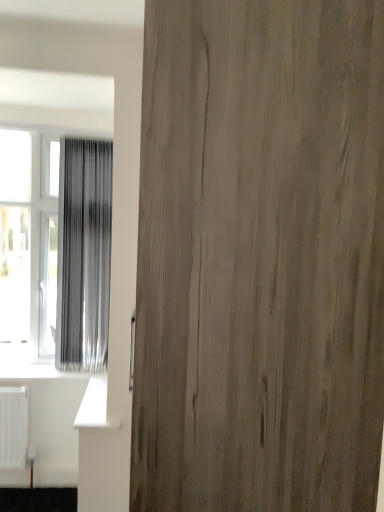
Question: From the image's perspective, would you say silvery metallic curtain at left is shown under wooden door at center?

Choices:
 (A) yes
 (B) no

Answer: (B)

Question: Does silvery metallic curtain at left have a larger size compared to wooden door at center?

Choices:
 (A) no
 (B) yes

Answer: (A)

Question: From a real-world perspective, does silvery metallic curtain at left sit lower than wooden door at center?

Choices:
 (A) no
 (B) yes

Answer: (A)

Question: Is silvery metallic curtain at left to the left of wooden door at center from the viewer's perspective?

Choices:
 (A) no
 (B) yes

Answer: (B)

Question: Is silvery metallic curtain at left wider than wooden door at center?

Choices:
 (A) no
 (B) yes

Answer: (A)

Question: Relative to wooden door at center, is silvery metallic curtain at left in front or behind?

Choices:
 (A) front
 (B) behind

Answer: (B)

Question: Looking at their shapes, would you say silvery metallic curtain at left is wider or thinner than wooden door at center?

Choices:
 (A) thin
 (B) wide

Answer: (A)

Question: Considering the positions of silvery metallic curtain at left and wooden door at center in the image, is silvery metallic curtain at left taller or shorter than wooden door at center?

Choices:
 (A) short
 (B) tall

Answer: (A)

Question: Considering the positions of point (112, 145) and point (238, 480), is point (112, 145) closer or farther from the camera than point (238, 480)?

Choices:
 (A) farther
 (B) closer

Answer: (A)

Question: Does point (18, 246) appear closer or farther from the camera than point (375, 493)?

Choices:
 (A) farther
 (B) closer

Answer: (A)

Question: In the image, is transparent plastic window at left positioned in front of or behind wooden door at center?

Choices:
 (A) front
 (B) behind

Answer: (B)

Question: Is transparent plastic window at left inside the boundaries of wooden door at center, or outside?

Choices:
 (A) outside
 (B) inside

Answer: (A)

Question: From a real-world perspective, is transparent plastic window at left positioned above or below wooden door at center?

Choices:
 (A) above
 (B) below

Answer: (B)

Question: Is wooden door at center inside the boundaries of silvery metallic curtain at left, or outside?

Choices:
 (A) outside
 (B) inside

Answer: (A)

Question: From a real-world perspective, is wooden door at center positioned above or below silvery metallic curtain at left?

Choices:
 (A) above
 (B) below

Answer: (B)